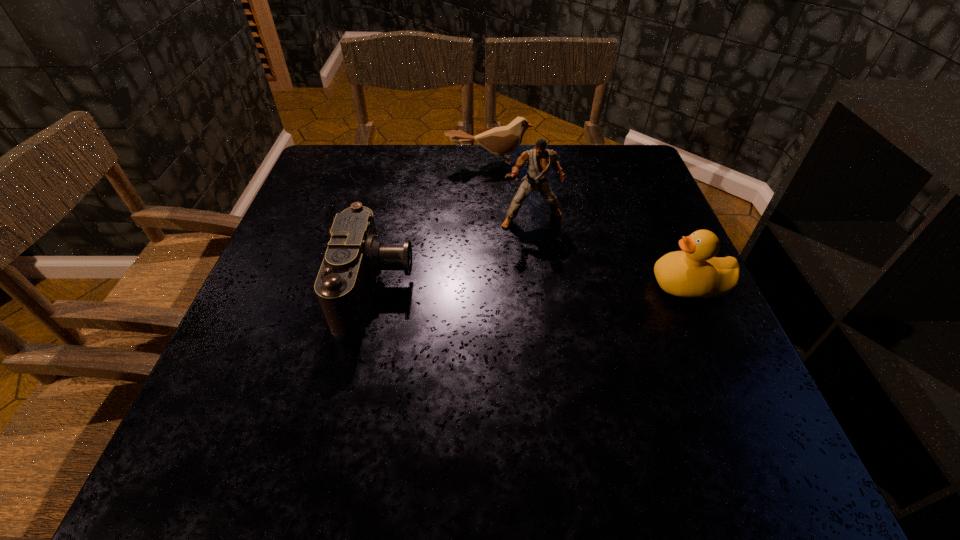
You are a GUI agent. You are given a task and a screenshot of the screen. Output one action in this format:
    pyautogui.click(x=<x>, y=<y>)
    Task: Click on the vacant space located 0.220m at the beak of the bird
    
    Given the screenshot: What is the action you would take?
    pyautogui.click(x=509, y=221)

The image size is (960, 540). What are the coordinates of `vacant area situated at the beak of the bird` in the screenshot? It's located at (519, 268).

The width and height of the screenshot is (960, 540). In order to click on free spot located 0.120m on the front-facing side of the puncher in this screenshot , I will do `click(548, 268)`.

Identify the location of free spot located 0.250m on the front-facing side of the puncher. (x=564, y=315).

You are a GUI agent. You are given a task and a screenshot of the screen. Output one action in this format:
    pyautogui.click(x=<x>, y=<y>)
    Task: Click on the blank space located 0.280m on the front-facing side of the puncher
    This screenshot has height=540, width=960.
    Given the screenshot: What is the action you would take?
    pyautogui.click(x=567, y=327)

At what (x,y) coordinates should I click in order to perform the action: click on object at the far edge. Please return your answer as a coordinate pair (x, y). This screenshot has height=540, width=960. Looking at the image, I should click on (501, 140).

I want to click on object located in the right edge section of the desktop, so click(x=694, y=272).

The height and width of the screenshot is (540, 960). I want to click on free space at the far edge, so click(461, 170).

You are a GUI agent. You are given a task and a screenshot of the screen. Output one action in this format:
    pyautogui.click(x=<x>, y=<y>)
    Task: Click on the vacant space at the near edge
    This screenshot has width=960, height=540.
    Given the screenshot: What is the action you would take?
    pyautogui.click(x=457, y=394)

The width and height of the screenshot is (960, 540). In the image, there is a desktop. Find the location of `vacant area at the left edge`. vacant area at the left edge is located at coordinates click(309, 195).